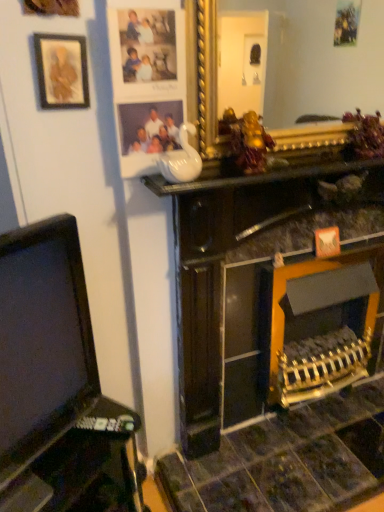
Question: From the image's perspective, does white glossy vase at upper center appear higher than matte plastic picture frame at upper center, which is counted as the 1th picture frame, starting from the right?

Choices:
 (A) yes
 (B) no

Answer: (B)

Question: Considering the relative positions of white glossy vase at upper center and matte plastic picture frame at upper center, which is the 2th picture frame from left to right, in the image provided, is white glossy vase at upper center to the right of matte plastic picture frame at upper center, which is the 2th picture frame from left to right, from the viewer's perspective?

Choices:
 (A) yes
 (B) no

Answer: (A)

Question: Is white glossy vase at upper center not within matte plastic picture frame at upper center, which is counted as the 1th picture frame, starting from the right?

Choices:
 (A) yes
 (B) no

Answer: (A)

Question: Is matte plastic picture frame at upper center, which is counted as the 1th picture frame, starting from the right, inside white glossy vase at upper center?

Choices:
 (A) yes
 (B) no

Answer: (B)

Question: From the image's perspective, would you say white glossy vase at upper center is shown under matte plastic picture frame at upper center, which is counted as the 1th picture frame, starting from the right?

Choices:
 (A) yes
 (B) no

Answer: (A)

Question: Considering the relative sizes of white glossy vase at upper center and matte plastic picture frame at upper center, which is counted as the 1th picture frame, starting from the right, in the image provided, is white glossy vase at upper center taller than matte plastic picture frame at upper center, which is counted as the 1th picture frame, starting from the right,?

Choices:
 (A) yes
 (B) no

Answer: (B)

Question: From a real-world perspective, does white glossy vase at upper center sit lower than matte gold picture frame at upper left, which appears as the 2th picture frame when viewed from the right?

Choices:
 (A) yes
 (B) no

Answer: (A)

Question: Could you tell me if white glossy vase at upper center is facing matte gold picture frame at upper left, which appears as the 2th picture frame when viewed from the right?

Choices:
 (A) yes
 (B) no

Answer: (B)

Question: Are white glossy vase at upper center and matte gold picture frame at upper left, the first picture frame viewed from the left, located far from each other?

Choices:
 (A) no
 (B) yes

Answer: (A)

Question: Is white glossy vase at upper center smaller than matte gold picture frame at upper left, the first picture frame viewed from the left?

Choices:
 (A) yes
 (B) no

Answer: (B)

Question: Is white glossy vase at upper center wider than matte gold picture frame at upper left, which appears as the 2th picture frame when viewed from the right?

Choices:
 (A) no
 (B) yes

Answer: (B)

Question: Can we say white glossy vase at upper center lies outside matte gold picture frame at upper left, the first picture frame viewed from the left?

Choices:
 (A) yes
 (B) no

Answer: (A)

Question: Is black plastic tv at left with matte plastic picture frame at upper center, which is counted as the 1th picture frame, starting from the right?

Choices:
 (A) no
 (B) yes

Answer: (A)